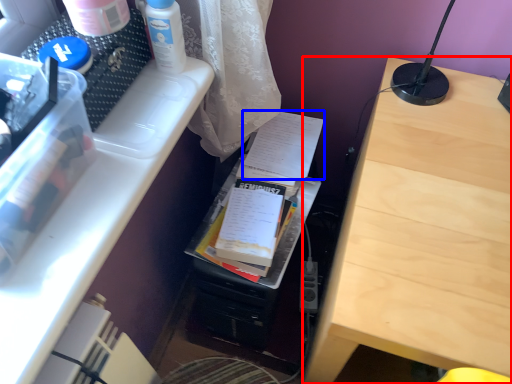
Question: Which of the following is the closest to the observer, table (highlighted by a red box) or document (highlighted by a blue box)?

Choices:
 (A) table
 (B) document

Answer: (A)